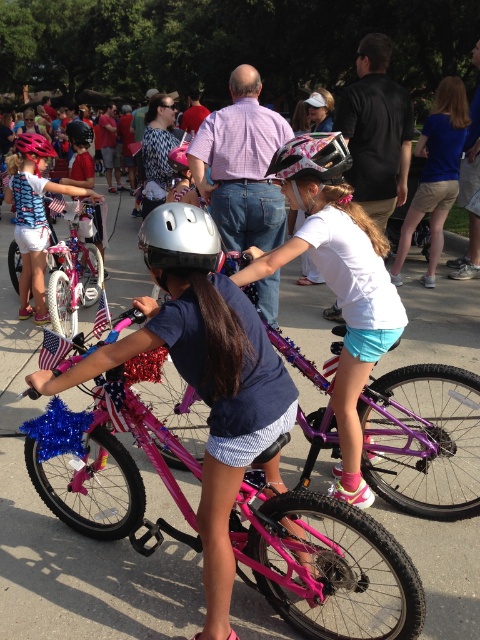
Which is more to the right, shiny pink bicycle at left or matte black helmet at upper center?

shiny pink bicycle at left

Which is behind, point (11, 193) or point (81, 124)?

The point (11, 193) is more distant.

I want to click on shiny pink bicycle at left, so coord(33,285).

Does silver metallic helmet at center come behind matte pink bicycle helmet at center?

No, it is not.

Which is in front, point (158, 257) or point (272, 172)?

Point (158, 257) is in front.

Is point (189, 218) positioned before point (338, 132)?

Yes, point (189, 218) is in front of point (338, 132).

Locate an element on the screen. The image size is (480, 640). silver metallic helmet at center is located at coordinates (180, 237).

Can you confirm if pink metallic bicycle at center is thinner than silver metallic helmet at center?

No, pink metallic bicycle at center is not thinner than silver metallic helmet at center.

What do you see at coordinates (324, 564) in the screenshot?
I see `pink metallic bicycle at center` at bounding box center [324, 564].

The image size is (480, 640). I want to click on pink metallic bicycle at center, so [324, 564].